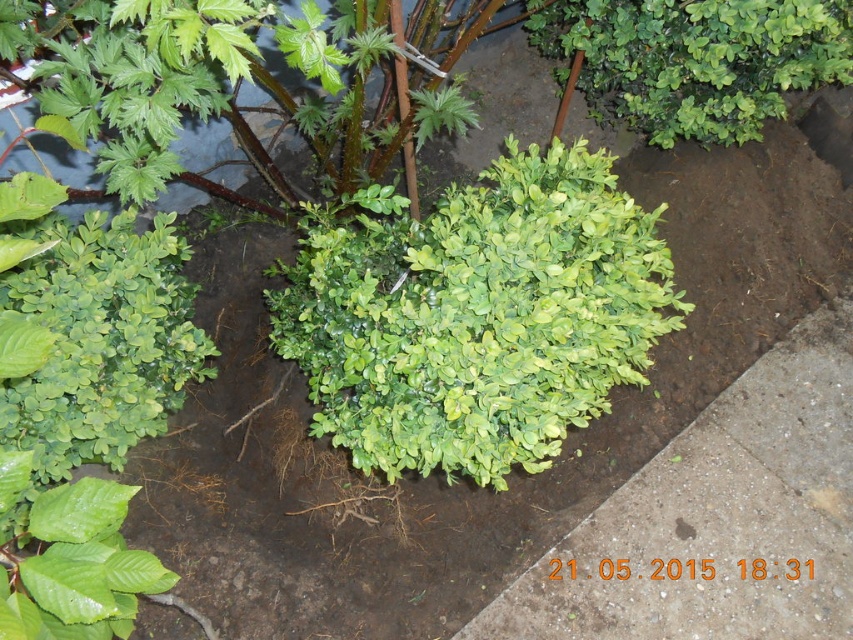
You are standing in the garden described in the scene. There is a point marked at coordinates (476, 314). Which object in the garden is located exactly at that point?

The point at coordinates (476, 314) marks the green leafy shrub at center.

In the scene shown: You are standing in the garden looking at the plants. There are two points marked in the image. One is at coordinate point (x=373, y=412) and the other is at point (x=679, y=26). Which point is closer to you?

Point (x=373, y=412) is closer to the camera than point (x=679, y=26).

You are a gardener who wants to plant a new flower between the green leafy shrub at center and the green matte shrub at upper right. Based on their positions, which shrub should you place the flower closer to?

The green leafy shrub at center is positioned on the left side of green matte shrub at upper right, so you should place the flower closer to the green leafy shrub at center to maintain symmetry between them.